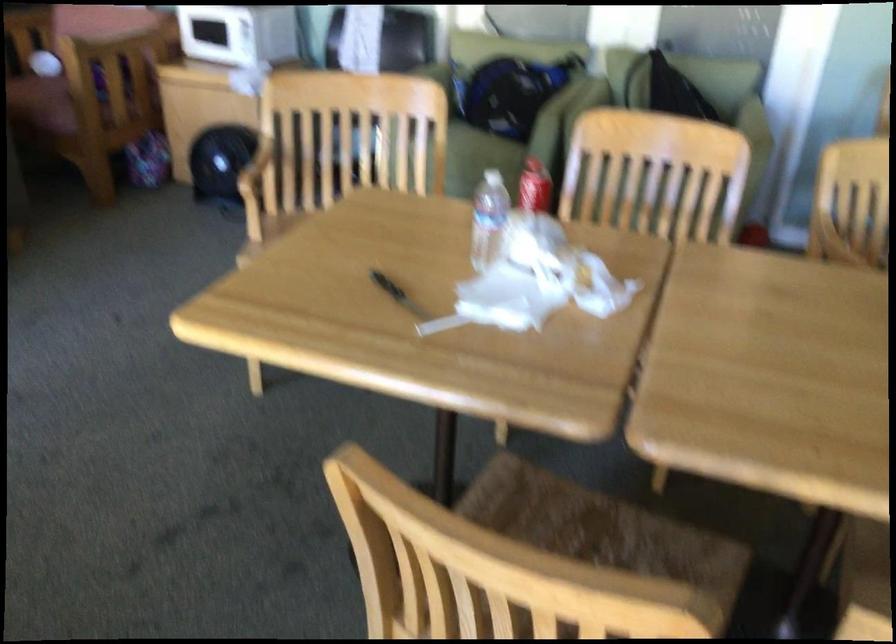
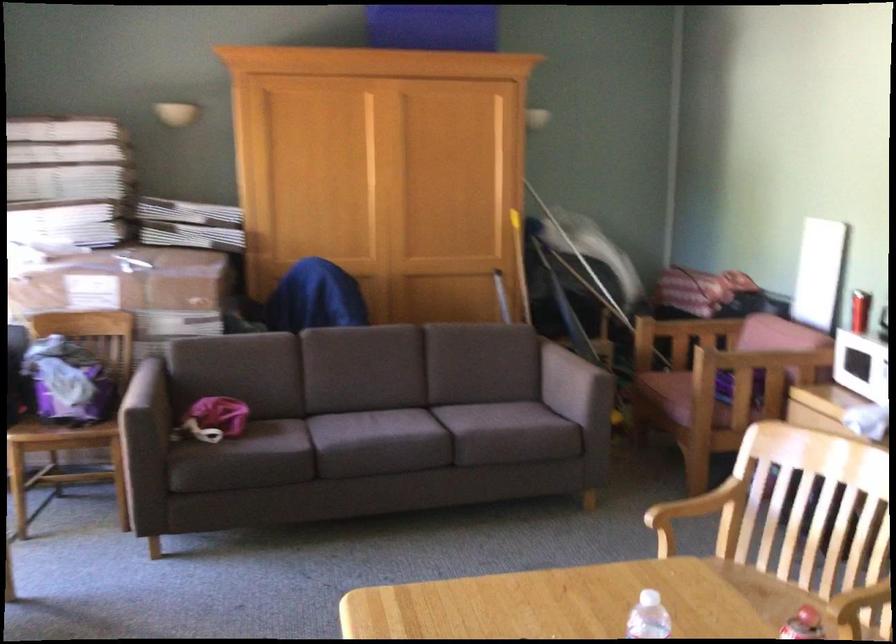
In the second image, find the point that corresponds to [291,243] in the first image.

(555, 603)